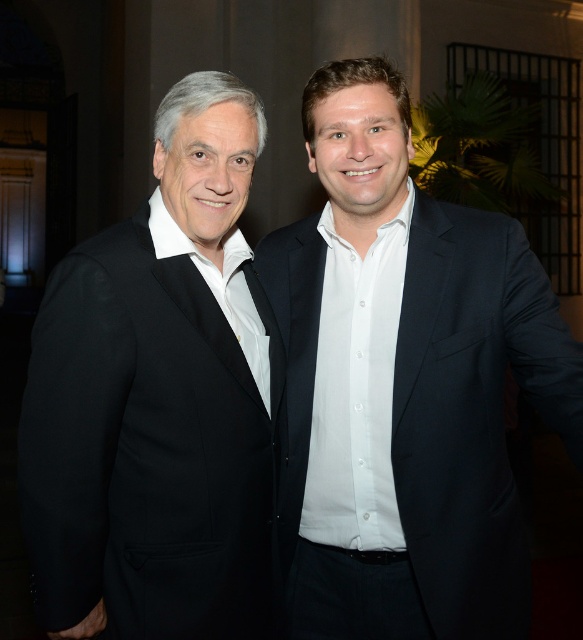
You are an event planner arranging a photo shoot. You need to position a camera to capture the white smooth suit at center. According to the coordinates provided, where should you focus the camera?

The white smooth suit at center is located at point (405, 385), so you should focus the camera at those coordinates to capture it accurately.